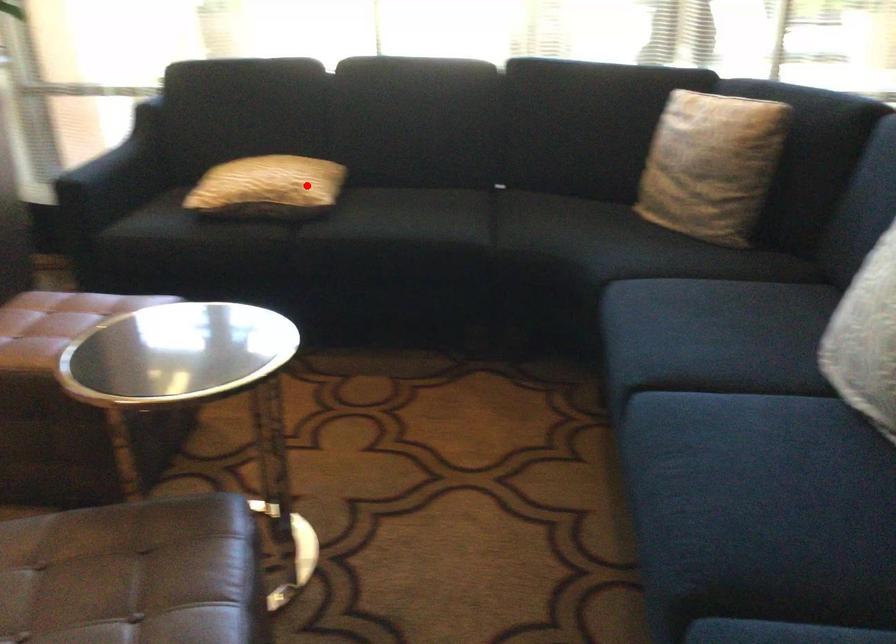
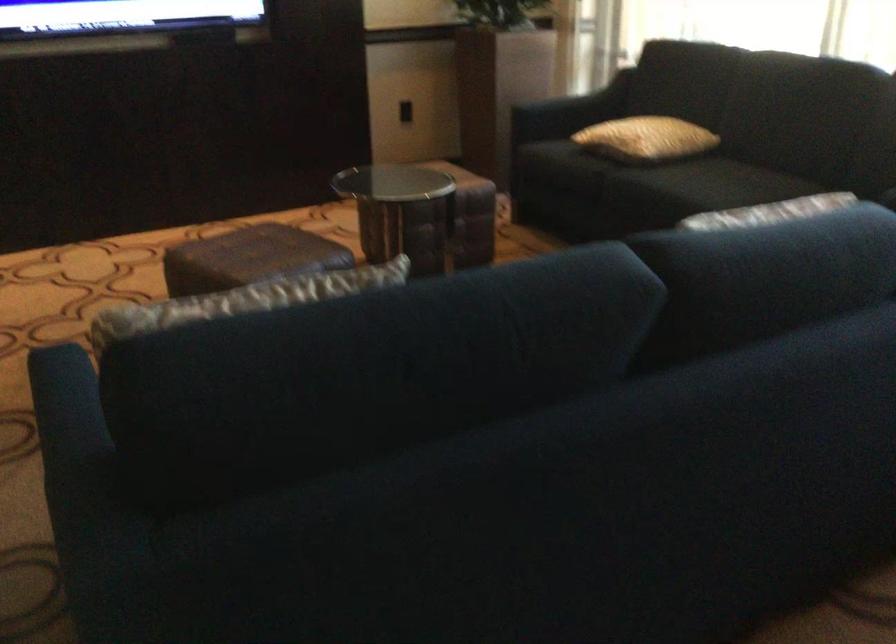
Find the pixel in the second image that matches the highlighted location in the first image.

(645, 138)